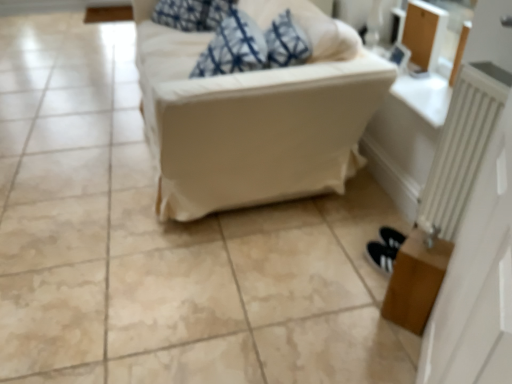
Question: Considering the positions of white fabric couch at center and white metallic radiator at right in the image, is white fabric couch at center bigger or smaller than white metallic radiator at right?

Choices:
 (A) big
 (B) small

Answer: (A)

Question: In terms of width, does white fabric couch at center look wider or thinner when compared to white metallic radiator at right?

Choices:
 (A) wide
 (B) thin

Answer: (A)

Question: Estimate the real-world distances between objects in this image. Which object is farther from the white fabric couch at center?

Choices:
 (A) brown wooden table at lower right
 (B) white metallic radiator at right

Answer: (A)

Question: Estimate the real-world distances between objects in this image. Which object is closer to the white fabric couch at center?

Choices:
 (A) white metallic radiator at right
 (B) brown wooden table at lower right

Answer: (A)